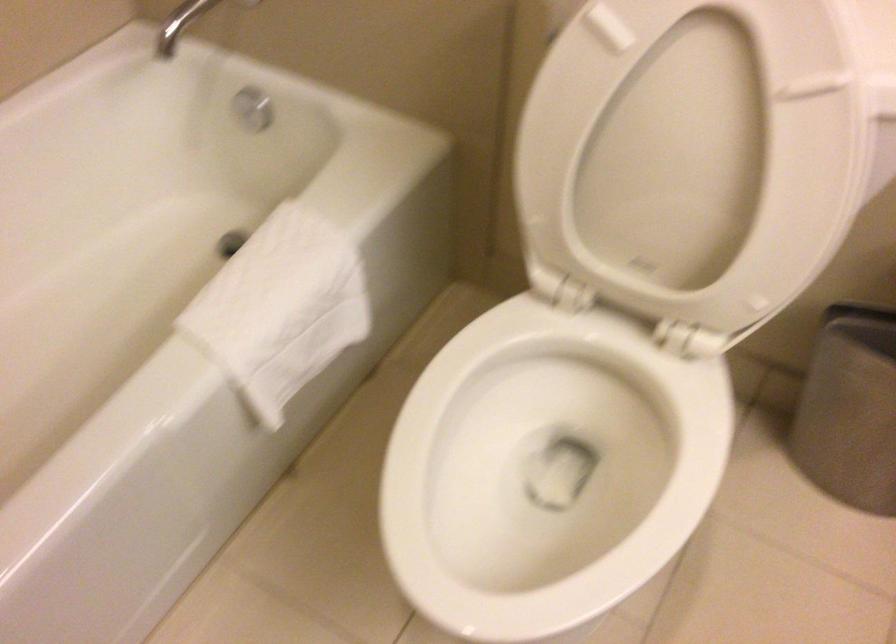
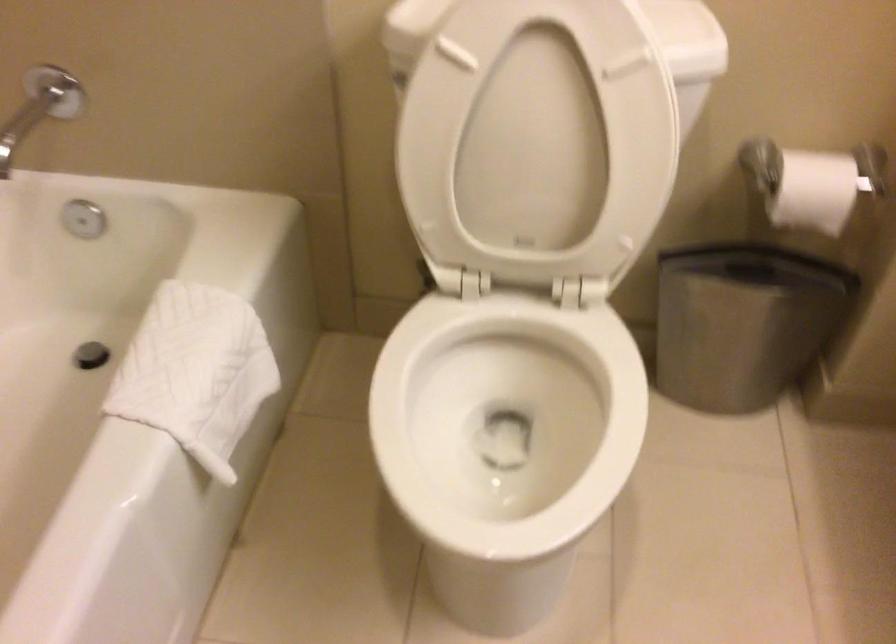
Where in the second image is the point corresponding to point (271, 307) from the first image?

(195, 372)